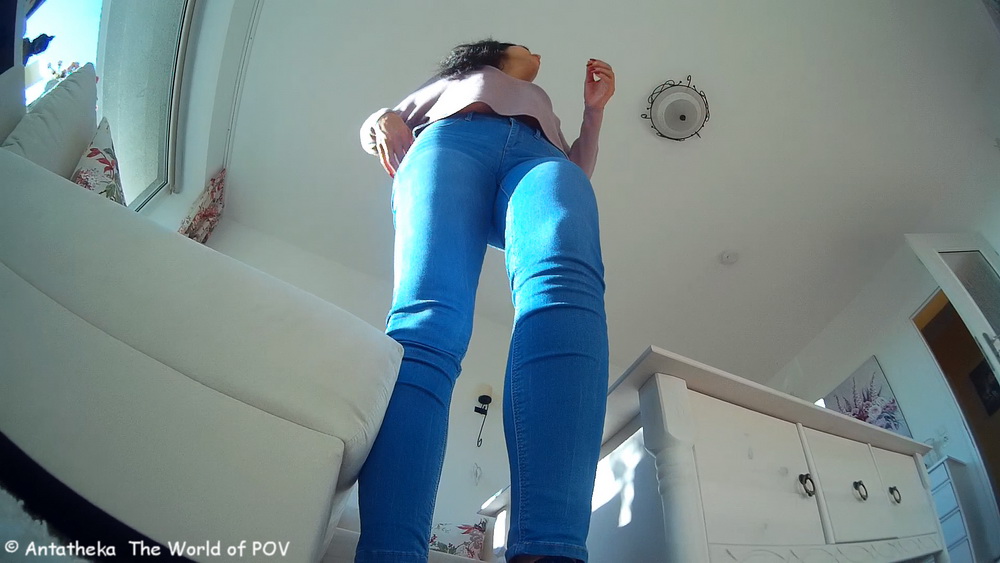
Find the location of a particular element. door is located at coordinates (955, 294).